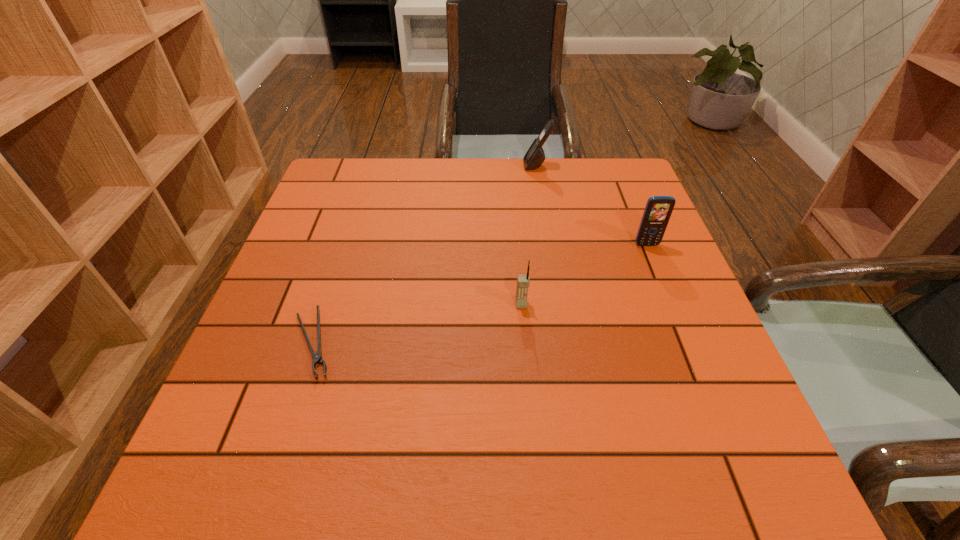
Identify the location of vacant space that satisfies the following two spatial constraints: 1. on the front-facing side of the farthest object; 2. on the front side of the shortest object. The image size is (960, 540). (566, 343).